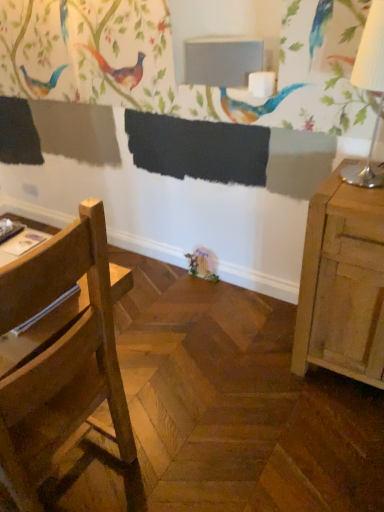
Where is `matte gray table at upper center`? The image size is (384, 512). matte gray table at upper center is located at coordinates (222, 60).

I want to click on white paper lampshade at right, so click(369, 89).

From the image's perspective, is matte gray table at upper center above or below wooden chair at left?

matte gray table at upper center is situated higher than wooden chair at left in the image.

From a real-world perspective, between matte gray table at upper center and wooden chair at left, who is vertically higher?

matte gray table at upper center.

The image size is (384, 512). In order to click on chair below the matte gray table at upper center (from a real-world perspective) in this screenshot , I will do `click(60, 356)`.

In the scene shown: From the image's perspective, is wooden chair at left positioned above or below white paper lampshade at right?

wooden chair at left is situated lower than white paper lampshade at right in the image.

Locate an element on the screen. This screenshot has height=512, width=384. table lamp positioned vertically above the wooden chair at left (from a real-world perspective) is located at coordinates (369, 89).

Is wooden chair at left taller than white paper lampshade at right?

Yes.

Does wooden chair at left lie in front of matte gray table at upper center?

Yes, wooden chair at left is in front of matte gray table at upper center.

Which object is wider, wooden chair at left or matte gray table at upper center?

Wider between the two is wooden chair at left.

Is wooden chair at left taller than matte gray table at upper center?

Yes.

From the image's perspective, is matte gray table at upper center located beneath white paper lampshade at right?

No, from the image's perspective, matte gray table at upper center is not below white paper lampshade at right.

Is point (246, 78) farther from viewer compared to point (376, 128)?

That is True.

From a real-world perspective, is matte gray table at upper center below white paper lampshade at right?

No, from a real-world perspective, matte gray table at upper center is not beneath white paper lampshade at right.

Would you say matte gray table at upper center is to the left or to the right of white paper lampshade at right in the picture?

Based on their positions, matte gray table at upper center is located to the left of white paper lampshade at right.

Where is `table lamp that is behind the wooden chair at left`? This screenshot has width=384, height=512. table lamp that is behind the wooden chair at left is located at coordinates (369, 89).

Which of these two, white paper lampshade at right or wooden chair at left, is thinner?

white paper lampshade at right.

From a real-world perspective, is white paper lampshade at right beneath wooden chair at left?

No, from a real-world perspective, white paper lampshade at right is not beneath wooden chair at left.

Considering the sizes of objects white paper lampshade at right and wooden chair at left in the image provided, who is smaller, white paper lampshade at right or wooden chair at left?

Smaller between the two is white paper lampshade at right.

Which object is thinner, white paper lampshade at right or matte gray table at upper center?

Thinner between the two is matte gray table at upper center.

Does white paper lampshade at right appear on the left side of matte gray table at upper center?

No, white paper lampshade at right is not to the left of matte gray table at upper center.

From the image's perspective, between white paper lampshade at right and matte gray table at upper center, who is located below?

white paper lampshade at right appears lower in the image.

Identify the location of table behind the wooden chair at left. The image size is (384, 512). 222,60.

In order to click on table lamp on the right of the wooden chair at left in this screenshot , I will do `click(369, 89)`.

Considering their positions, is matte gray table at upper center positioned closer to white paper lampshade at right than wooden chair at left?

Based on the image, matte gray table at upper center appears to be nearer to white paper lampshade at right.

Looking at the image, which one is located further to wooden chair at left, white paper lampshade at right or matte gray table at upper center?

Based on the image, matte gray table at upper center appears to be further to wooden chair at left.

Estimate the real-world distances between objects in this image. Which object is closer to matte gray table at upper center, wooden chair at left or white paper lampshade at right?

Based on the image, white paper lampshade at right appears to be nearer to matte gray table at upper center.

Estimate the real-world distances between objects in this image. Which object is closer to wooden chair at left, matte gray table at upper center or white paper lampshade at right?

white paper lampshade at right lies closer to wooden chair at left than the other object.

From the image, which object appears to be farther from matte gray table at upper center, white paper lampshade at right or wooden chair at left?

wooden chair at left is further to matte gray table at upper center.

Considering their positions, is wooden chair at left positioned further to white paper lampshade at right than matte gray table at upper center?

Among the two, wooden chair at left is located further to white paper lampshade at right.

Identify the location of table lamp between matte gray table at upper center and wooden chair at left vertically. (369, 89).